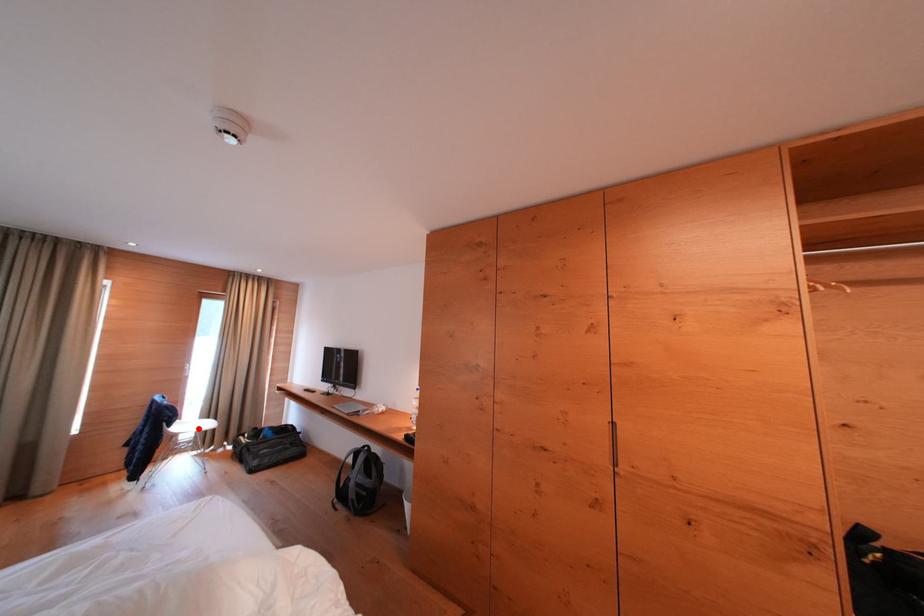
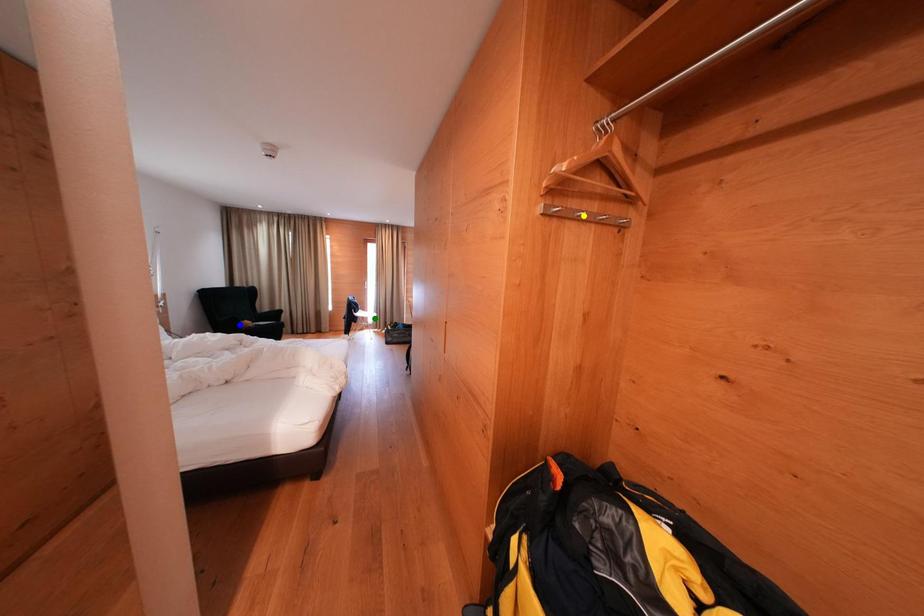
Question: I am providing you with two images of the same scene from different viewpoints. A red point is marked on the first image. You are given multiple points on the second image. Which spot in image 2 lines up with the point in image 1?

Choices:
 (A) yellow point
 (B) blue point
 (C) green point

Answer: (C)